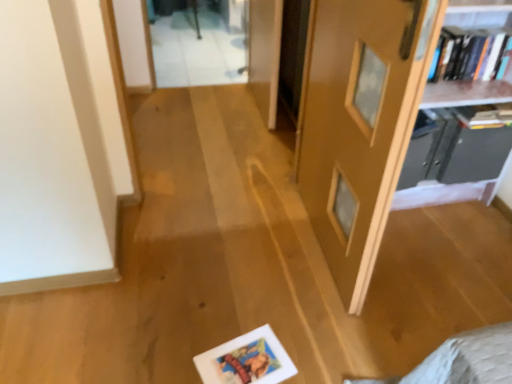
Where is `vacant space to the left of white matte picture frame at lower center`? Image resolution: width=512 pixels, height=384 pixels. vacant space to the left of white matte picture frame at lower center is located at coordinates (180, 347).